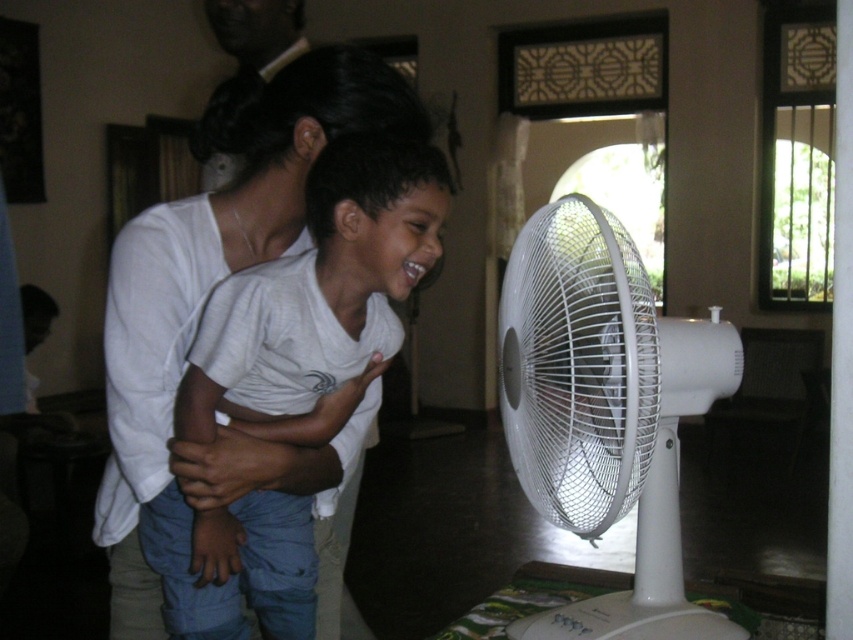
From the picture: Can you confirm if white plastic mechanical fan at center is shorter than white cotton shirt at center?

Indeed, white plastic mechanical fan at center has a lesser height compared to white cotton shirt at center.

Based on the photo, does white plastic mechanical fan at center appear under white cotton shirt at center?

Yes, white plastic mechanical fan at center is below white cotton shirt at center.

This screenshot has height=640, width=853. Identify the location of white plastic mechanical fan at center. (605, 412).

Image resolution: width=853 pixels, height=640 pixels. Describe the element at coordinates (605, 412) in the screenshot. I see `white plastic mechanical fan at center` at that location.

Does white plastic mechanical fan at center come in front of black hair at upper center?

That is True.

Is point (665, 392) farther from viewer compared to point (289, 4)?

No, it is not.

I want to click on white plastic mechanical fan at center, so click(x=605, y=412).

Does white cotton shirt at center lie behind black hair at upper center?

No, white cotton shirt at center is closer to the viewer.

Image resolution: width=853 pixels, height=640 pixels. Describe the element at coordinates (322, 285) in the screenshot. I see `white cotton shirt at center` at that location.

Measure the distance between point (259, 317) and camera.

3.30 feet

Image resolution: width=853 pixels, height=640 pixels. I want to click on white cotton shirt at center, so click(322, 285).